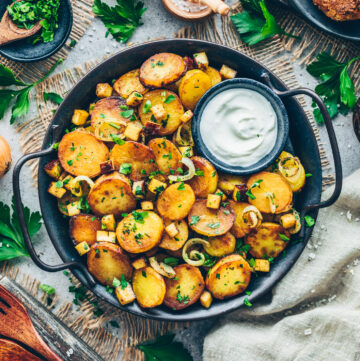
Locate an element on the screen. grey plate is located at coordinates (326, 26).